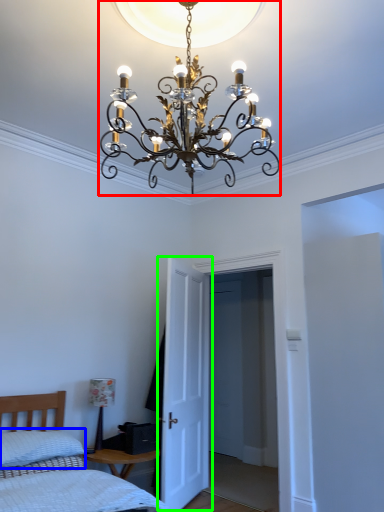
Question: Estimate the real-world distances between objects in this image. Which object is closer to lamp (highlighted by a red box), pillow (highlighted by a blue box) or door (highlighted by a green box)?

Choices:
 (A) pillow
 (B) door

Answer: (B)